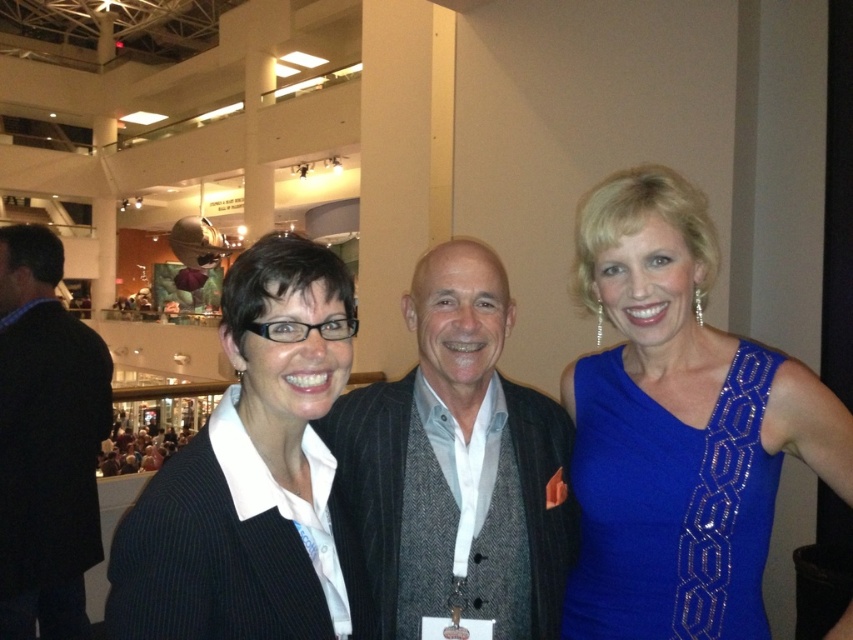
You are a photographer at the event and need to adjust the lighting so that the blue sequined dress at right and dark gray suit at center are both well lit. Considering their heights, which one might require a lower light source to avoid shadows?

The blue sequined dress at right has a lesser height compared to dark gray suit at center, so it might require a lower light source to avoid shadows.

You are standing at the entrance of the venue and want to take a photo of the blue sequined dress at right and the dark gray suit at center. Based on their positions, which one would appear higher in the photo?

The blue sequened dress at right appears higher in the photo because it is positioned above the dark gray suit at center.

Based on the photo, you are trying to find the black pinstripe blazer at center and the dark gray textured suit at center in the image. Which one is located to the left?

The black pinstripe blazer at center is positioned on the left side of dark gray textured suit at center, so the black pinstripe blazer at center is located to the left.